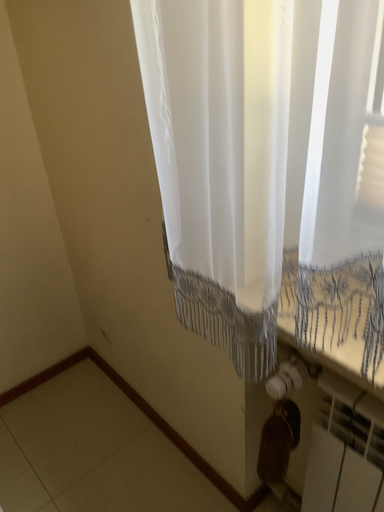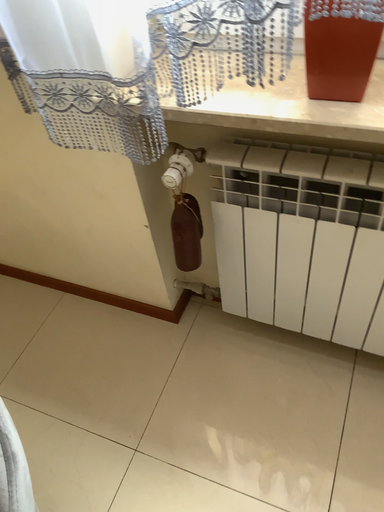
Question: Which way did the camera rotate in the video?

Choices:
 (A) rotated upward
 (B) rotated downward

Answer: (B)